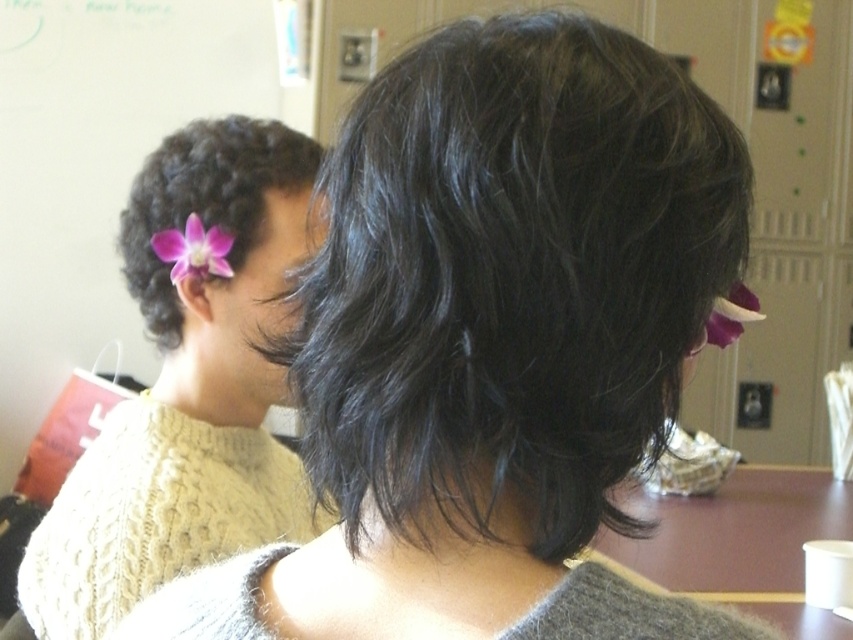
Question: Is pink flower at left closer to the viewer compared to purple matte flower at upper left?

Choices:
 (A) yes
 (B) no

Answer: (A)

Question: Does purple matte flower at left appear on the left side of purple matte flower at upper right?

Choices:
 (A) no
 (B) yes

Answer: (B)

Question: Which point appears farthest from the camera in this image?

Choices:
 (A) (302, 161)
 (B) (223, 241)
 (C) (44, 538)
 (D) (728, 339)

Answer: (A)

Question: Which object is closer to the camera taking this photo?

Choices:
 (A) purple matte flower at left
 (B) pink flower at left
 (C) purple matte flower at upper right
 (D) purple matte flower at upper left

Answer: (C)

Question: Which point is farther to the camera?

Choices:
 (A) purple matte flower at upper left
 (B) purple matte flower at upper right
 (C) purple matte flower at left

Answer: (A)

Question: Is pink flower at left above purple matte flower at upper left?

Choices:
 (A) no
 (B) yes

Answer: (A)